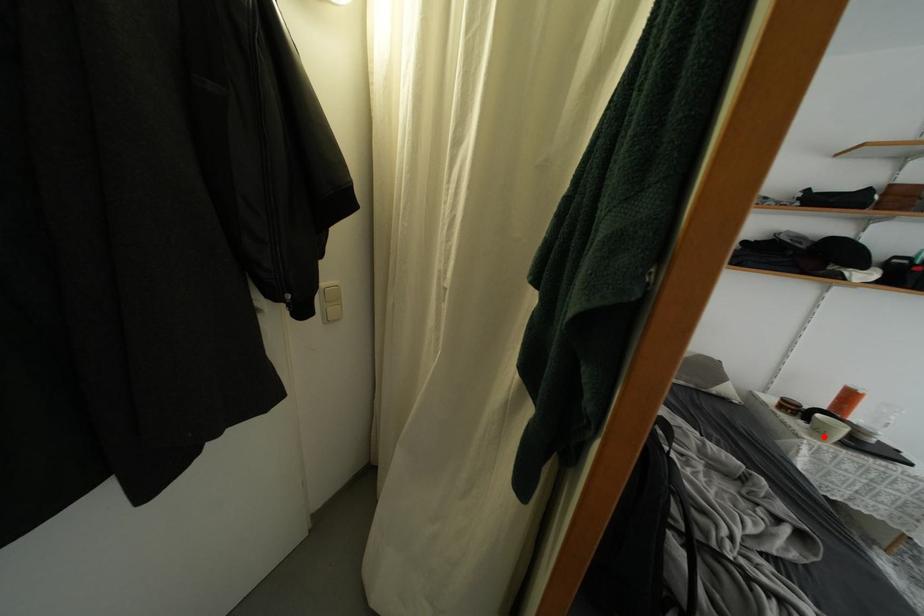
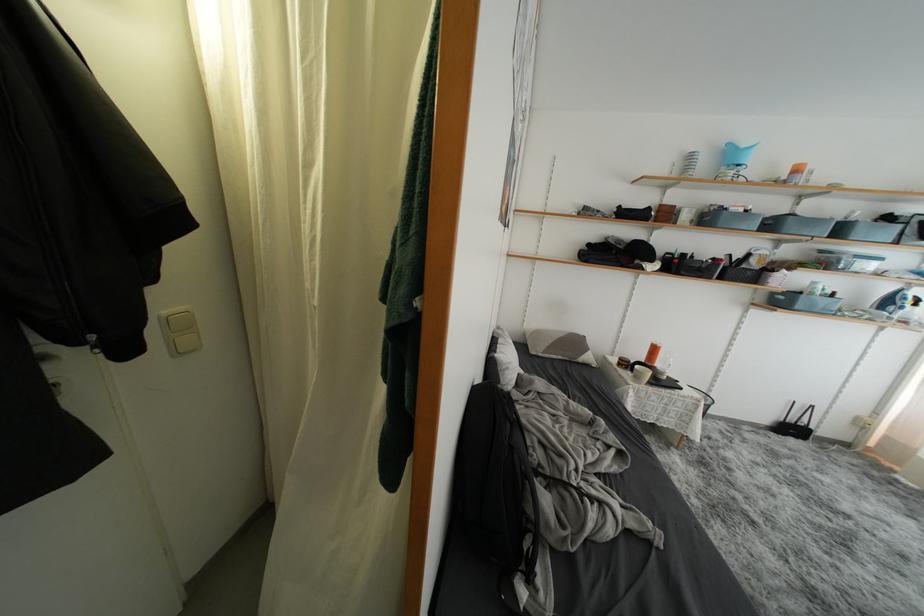
In the second image, find the point that corresponds to the highlighted location in the first image.

(642, 382)